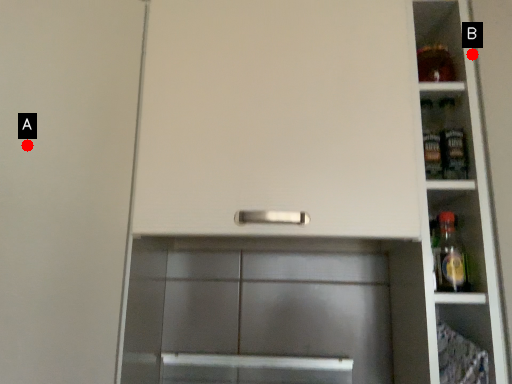
Question: Two points are circled on the image, labeled by A and B beside each circle. Which point appears closest to the camera in this image?

Choices:
 (A) A is closer
 (B) B is closer

Answer: (A)